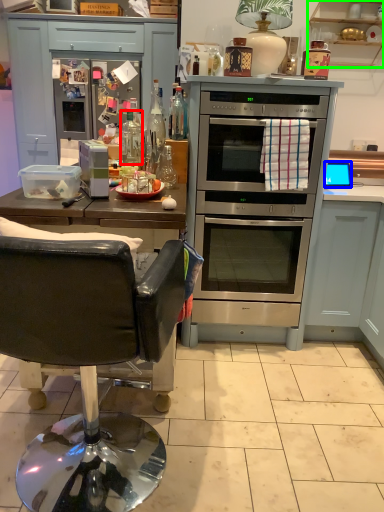
Question: Estimate the real-world distances between objects in this image. Which object is closer to bottle (highlighted by a red box), appliance (highlighted by a blue box) or cabinetry (highlighted by a green box)?

Choices:
 (A) appliance
 (B) cabinetry

Answer: (A)